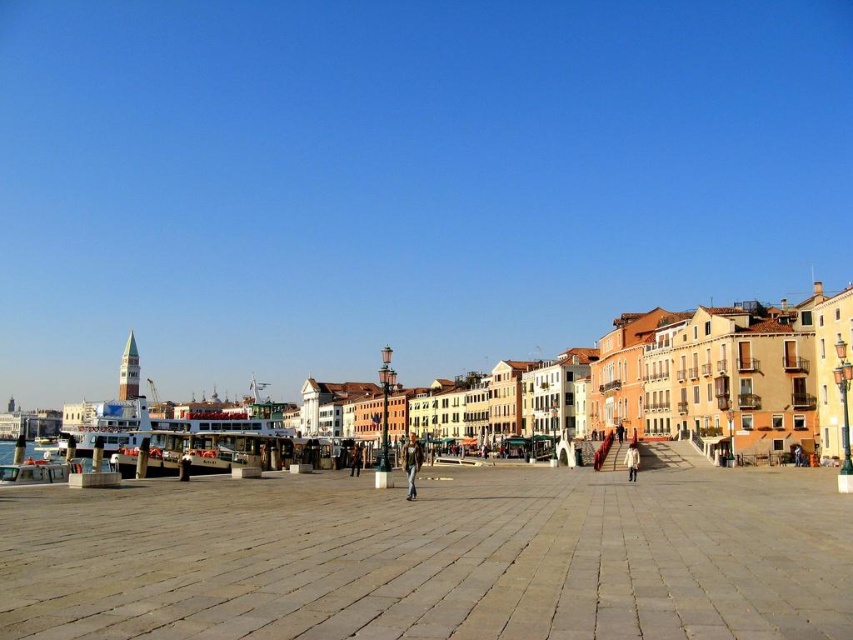
Which is behind, point (634, 465) or point (357, 445)?

The point (357, 445) is behind.

Is point (624, 456) closer to viewer compared to point (351, 465)?

Yes, point (624, 456) is closer to viewer.

The height and width of the screenshot is (640, 853). I want to click on white matte coat at center, so click(631, 460).

Can you confirm if leather jacket at center is positioned below white matte coat at center?

Yes.

Which is in front, point (410, 472) or point (631, 468)?

Point (410, 472) is in front.

Where is `leather jacket at center`? Image resolution: width=853 pixels, height=640 pixels. leather jacket at center is located at coordinates (410, 464).

Does light brown stone pavement at center appear on the right side of brown leather jacket at center?

Correct, you'll find light brown stone pavement at center to the right of brown leather jacket at center.

Can you confirm if light brown stone pavement at center is thinner than brown leather jacket at center?

In fact, light brown stone pavement at center might be wider than brown leather jacket at center.

Where is `light brown stone pavement at center`? The image size is (853, 640). light brown stone pavement at center is located at coordinates (434, 557).

At what (x,y) coordinates should I click in order to perform the action: click on light brown stone pavement at center. Please return your answer as a coordinate pair (x, y). The image size is (853, 640). Looking at the image, I should click on (434, 557).